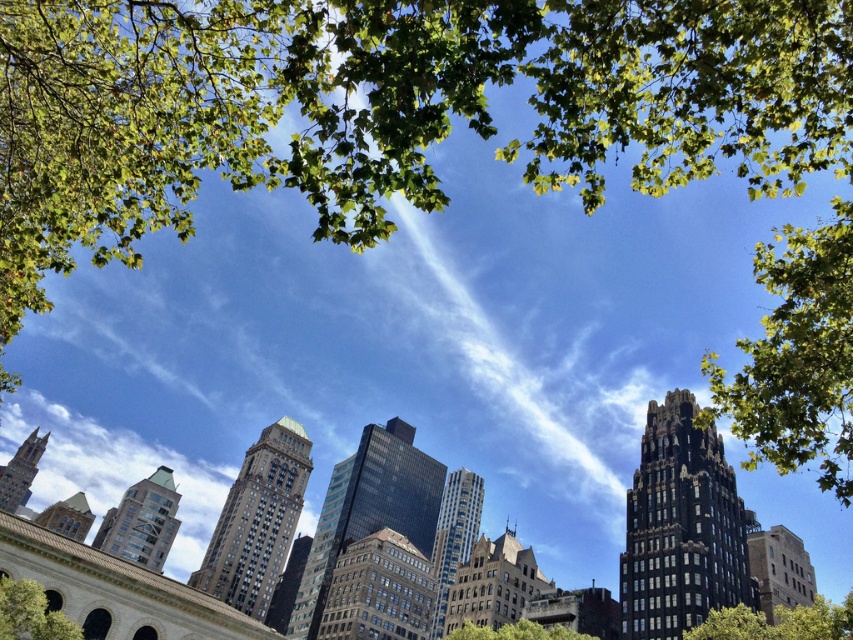
Is green leafy tree at lower left closer to the viewer compared to green leafy tree at center?

That is True.

Can you confirm if green leafy tree at lower left is smaller than green leafy tree at center?

Correct, green leafy tree at lower left occupies less space than green leafy tree at center.

At what (x,y) coordinates should I click in order to perform the action: click on green leafy tree at lower left. Please return your answer as a coordinate pair (x, y). Image resolution: width=853 pixels, height=640 pixels. Looking at the image, I should click on (30, 612).

Does green leafy tree at lower right have a smaller size compared to green leafy tree at center?

No, green leafy tree at lower right is not smaller than green leafy tree at center.

Is green leafy tree at lower right positioned before green leafy tree at center?

Yes.

What do you see at coordinates (778, 621) in the screenshot?
I see `green leafy tree at lower right` at bounding box center [778, 621].

Identify the location of green leafy tree at lower right. The height and width of the screenshot is (640, 853). (778, 621).

Who is lower down, green leafy tree at lower right or green leafy tree at lower left?

green leafy tree at lower right

Does green leafy tree at lower right come in front of green leafy tree at lower left?

No, it is not.

I want to click on green leafy tree at lower right, so (x=778, y=621).